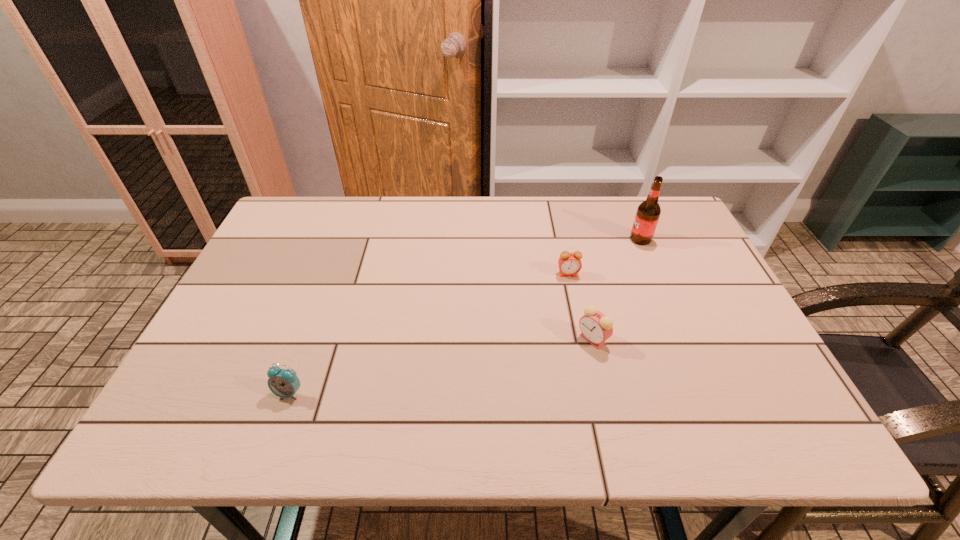
Point out which object is positioned as the second nearest to the third nearest object. Please provide its 2D coordinates. Your answer should be formatted as a tuple, i.e. [(x, y)], where the tuple contains the x and y coordinates of a point satisfying the conditions above.

[(648, 212)]

Select which object is the third closest to the tallest object. Please provide its 2D coordinates. Your answer should be formatted as a tuple, i.e. [(x, y)], where the tuple contains the x and y coordinates of a point satisfying the conditions above.

[(284, 383)]

Identify the location of alarm clock object that ranks as the closest to the second nearest object. (569, 263).

Identify which alarm clock is the closest to the nearest object. Please provide its 2D coordinates. Your answer should be formatted as a tuple, i.e. [(x, y)], where the tuple contains the x and y coordinates of a point satisfying the conditions above.

[(596, 328)]